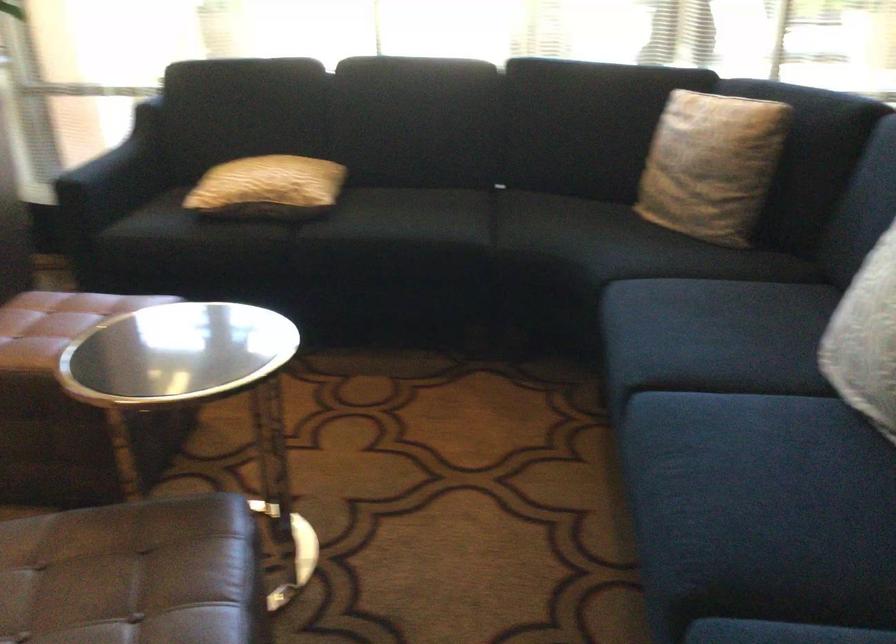
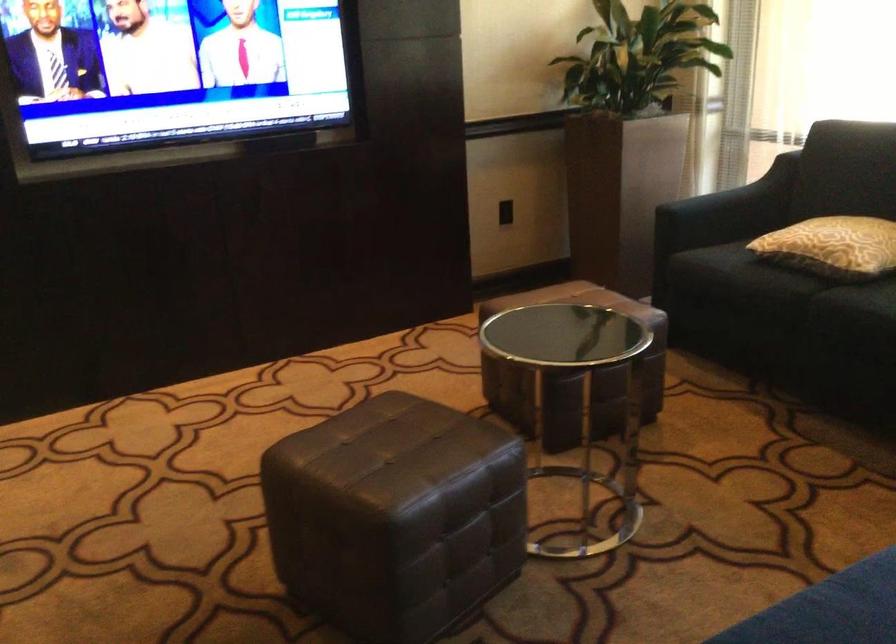
Question: I am providing you with two images of the same scene from different viewpoints. After the viewpoint changes to image2, which objects are now occluded?

Choices:
 (A) brown leather ottoman
 (B) sofa sitting surface
 (C) sofa armrest
 (D) none of these

Answer: (D)